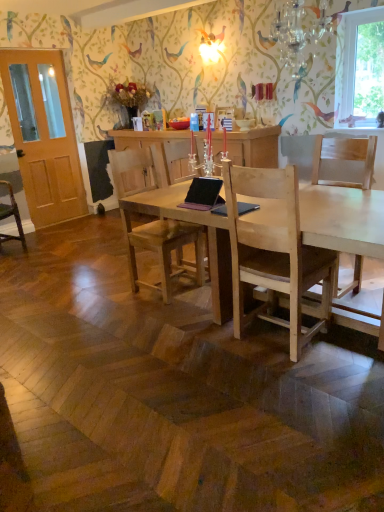
At what (x,y) coordinates should I click in order to perform the action: click on clear glass window at upper right. Please return your answer as a coordinate pair (x, y). Looking at the image, I should click on (359, 68).

What do you see at coordinates (11, 215) in the screenshot? I see `wooden chair at left, the 1th chair in the left-to-right sequence` at bounding box center [11, 215].

At what (x,y) coordinates should I click in order to perform the action: click on pink leather laptop at center. Please return your answer as a coordinate pair (x, y). The width and height of the screenshot is (384, 512). Looking at the image, I should click on (203, 194).

In order to click on natural wood desk at center in this screenshot , I will do coord(343,219).

The width and height of the screenshot is (384, 512). I want to click on light brown wooden door at left, so click(x=43, y=135).

In order to click on lamp below the light brown wooden door at left (from the image's perspective) in this screenshot , I will do `click(298, 29)`.

Is crystal glass chandelier at upper center bigger than light brown wooden door at left?

No.

From a real-world perspective, which object rests below the other?

In real-world perspective, light brown wooden door at left is lower.

Is crystal glass chandelier at upper center facing towards light brown wooden door at left?

No, crystal glass chandelier at upper center is not oriented towards light brown wooden door at left.

From a real-world perspective, which is physically above, crystal glass chandelier at upper center or clear glass window at upper right?

crystal glass chandelier at upper center.

Find the location of a particular element. The image size is (384, 512). lamp on the left of clear glass window at upper right is located at coordinates pyautogui.click(x=298, y=29).

Is point (325, 11) closer or farther from the camera than point (338, 74)?

Point (325, 11) appears to be closer to the viewer than point (338, 74).

What's the angular difference between crystal glass chandelier at upper center and clear glass window at upper right's facing directions?

There is a 0.93-degree angle between the facing directions of crystal glass chandelier at upper center and clear glass window at upper right.

Considering the relative positions of wooden chair at left, the 3th chair when ordered from right to left, and natural wood desk at center in the image provided, is wooden chair at left, the 3th chair when ordered from right to left, to the right of natural wood desk at center from the viewer's perspective?

No, wooden chair at left, the 3th chair when ordered from right to left, is not to the right of natural wood desk at center.

From the image's perspective, does wooden chair at left, the 3th chair when ordered from right to left, appear lower than natural wood desk at center?

No, from the image's perspective, wooden chair at left, the 3th chair when ordered from right to left, is not below natural wood desk at center.

Is natural wood desk at center completely or partially inside wooden chair at left, which is counted as the 1th chair, starting from the back?

No, natural wood desk at center is located outside of wooden chair at left, which is counted as the 1th chair, starting from the back.

Is wooden chair at left, which is counted as the 1th chair, starting from the back, positioned with its back to natural wood desk at center?

No, wooden chair at left, which is counted as the 1th chair, starting from the back, is not facing away from natural wood desk at center.

Which is in front, point (185, 190) or point (296, 2)?

Positioned in front is point (185, 190).

From the image's perspective, between natural wood desk at center and crystal glass chandelier at upper center, which one is located above?

crystal glass chandelier at upper center, from the image's perspective.

Who is smaller, clear glass window at upper right or light brown wooden chair at center, the second chair when ordered from left to right?

clear glass window at upper right is smaller.

Does clear glass window at upper right contain light brown wooden chair at center, which is the second chair in right-to-left order?

No, light brown wooden chair at center, which is the second chair in right-to-left order, is not surrounded by clear glass window at upper right.

Which object is thinner, clear glass window at upper right or light brown wooden chair at center, which is the second chair in right-to-left order?

clear glass window at upper right is thinner.

Who is taller, light brown wooden chair at center, which ranks as the second chair in front-to-back order, or light wood chair at center, marked as the 3th chair in a left-to-right arrangement?

With more height is light brown wooden chair at center, which ranks as the second chair in front-to-back order.

Is light brown wooden chair at center, which is the second chair in back-to-front order, touching light wood chair at center, marked as the first chair in a front-to-back arrangement?

No, light brown wooden chair at center, which is the second chair in back-to-front order, is not next to light wood chair at center, marked as the first chair in a front-to-back arrangement.

Is light wood chair at center, marked as the 3th chair in a left-to-right arrangement, surrounded by light brown wooden chair at center, which ranks as the second chair in front-to-back order?

No, light wood chair at center, marked as the 3th chair in a left-to-right arrangement, is not inside light brown wooden chair at center, which ranks as the second chair in front-to-back order.

Is light brown wooden chair at center, which ranks as the second chair in front-to-back order, further to the viewer compared to light wood chair at center, marked as the first chair in a front-to-back arrangement?

Yes.

Visually, is wooden chair at left, the 3th chair when ordered from right to left, positioned to the left or to the right of light wood chair at center, which appears as the 1th chair when viewed from the right?

Based on their positions, wooden chair at left, the 3th chair when ordered from right to left, is located to the left of light wood chair at center, which appears as the 1th chair when viewed from the right.

In terms of size, does wooden chair at left, the third chair when ordered from front to back, appear bigger or smaller than light wood chair at center, which is the third chair in back-to-front order?

wooden chair at left, the third chair when ordered from front to back, is smaller than light wood chair at center, which is the third chair in back-to-front order.

Can you confirm if wooden chair at left, the 3th chair when ordered from right to left, is thinner than light wood chair at center, marked as the 3th chair in a left-to-right arrangement?

Incorrect, the width of wooden chair at left, the 3th chair when ordered from right to left, is not less than that of light wood chair at center, marked as the 3th chair in a left-to-right arrangement.

You are a GUI agent. You are given a task and a screenshot of the screen. Output one action in this format:
    pyautogui.click(x=<x>, y=<y>)
    Task: Click on the glass door on the left of crystal glass chandelier at upper center
    The height and width of the screenshot is (512, 384).
    Given the screenshot: What is the action you would take?
    pyautogui.click(x=43, y=135)

Where is `window lying behind the crystal glass chandelier at upper center`? This screenshot has height=512, width=384. window lying behind the crystal glass chandelier at upper center is located at coordinates click(359, 68).

When comparing their distances from light wood chair at center, which is the third chair in back-to-front order, does wooden chair at left, the third chair when ordered from front to back, or light brown wooden door at left seem closer?

Based on the image, wooden chair at left, the third chair when ordered from front to back, appears to be nearer to light wood chair at center, which is the third chair in back-to-front order.

Looking at the image, which one is located further to clear glass window at upper right, pink leather laptop at center or light brown wooden chair at center, which is the second chair in back-to-front order?

light brown wooden chair at center, which is the second chair in back-to-front order, is positioned further to the anchor clear glass window at upper right.

From the image, which object appears to be farther from natural wood desk at center, light wood chair at center, which is the third chair in back-to-front order, or pink leather laptop at center?

Among the two, light wood chair at center, which is the third chair in back-to-front order, is located further to natural wood desk at center.

Looking at this image, based on their spatial positions, is clear glass window at upper right or wooden chair at left, the third chair when ordered from front to back, closer to light brown wooden chair at center, the second chair when ordered from left to right?

wooden chair at left, the third chair when ordered from front to back, is closer to light brown wooden chair at center, the second chair when ordered from left to right.

Estimate the real-world distances between objects in this image. Which object is closer to light brown wooden door at left, natural wood desk at center or light wood chair at center, marked as the first chair in a front-to-back arrangement?

natural wood desk at center is positioned closer to the anchor light brown wooden door at left.

Considering their positions, is natural wood desk at center positioned closer to light wood chair at center, which appears as the 1th chair when viewed from the right, than wooden chair at left, the third chair when ordered from front to back?

natural wood desk at center is positioned closer to the anchor light wood chair at center, which appears as the 1th chair when viewed from the right.

When comparing their distances from light brown wooden door at left, does light wood chair at center, which is the third chair in back-to-front order, or clear glass window at upper right seem closer?

clear glass window at upper right is closer to light brown wooden door at left.

In the scene shown: Considering their positions, is light brown wooden chair at center, which is the second chair in back-to-front order, positioned further to light brown wooden door at left than natural wood desk at center?

The object further to light brown wooden door at left is natural wood desk at center.

At what (x,y) coordinates should I click in order to perform the action: click on laptop between light brown wooden chair at center, which is the second chair in back-to-front order, and light wood chair at center, which appears as the 1th chair when viewed from the right, in the horizontal direction. Please return your answer as a coordinate pair (x, y). The height and width of the screenshot is (512, 384). Looking at the image, I should click on (203, 194).

I want to click on laptop between light brown wooden chair at center, which is the second chair in back-to-front order, and clear glass window at upper right, in the horizontal direction, so click(x=203, y=194).

This screenshot has height=512, width=384. What are the coordinates of `laptop between crystal glass chandelier at upper center and light wood chair at center, marked as the 3th chair in a left-to-right arrangement, vertically` in the screenshot? It's located at (203, 194).

Identify the location of laptop between light brown wooden door at left and clear glass window at upper right. [203, 194].